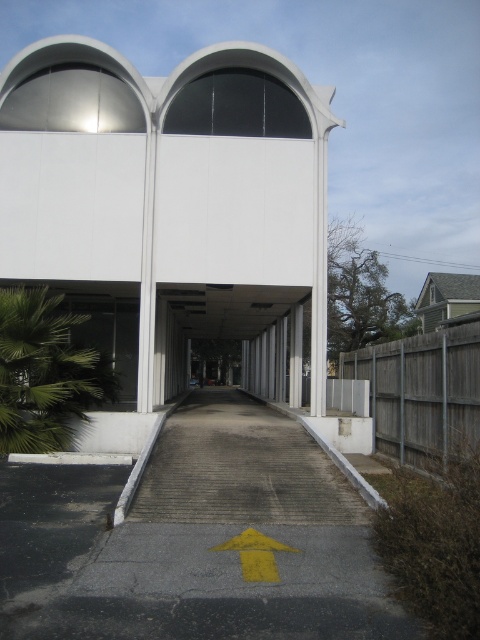
You are a delivery driver approaching the entrance of this modern building. You see a wooden fence at right and a yellow matte arrow at center. The arrow points towards the loading dock. If you need to park your truck 20 feet away from the arrow, which object should you use as a reference to ensure proper parking distance?

The wooden fence at right is 19.99 feet from the yellow matte arrow at center, so you should use the wooden fence at right as your reference point since it is approximately 20 feet away from the arrow. Park your truck near the wooden fence at right to maintain the required distance.